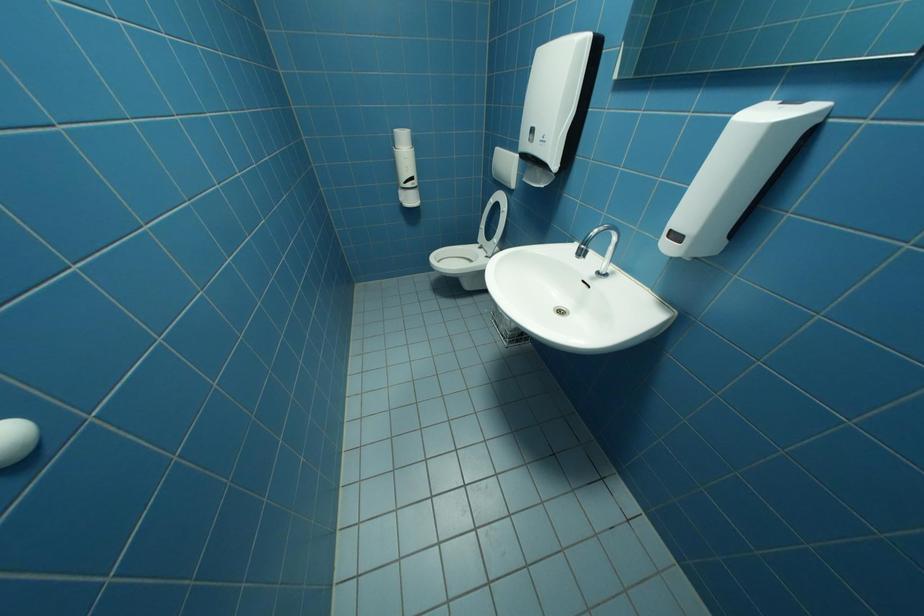
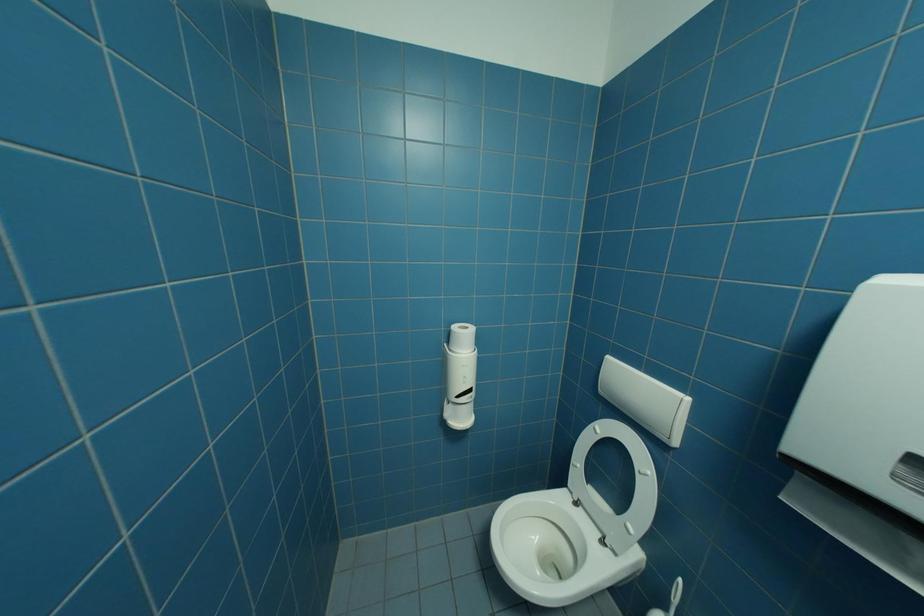
Based on the photo, the images are taken continuously from a first-person perspective. In which direction are you moving?

The movement direction of the cameraman is left, forward.